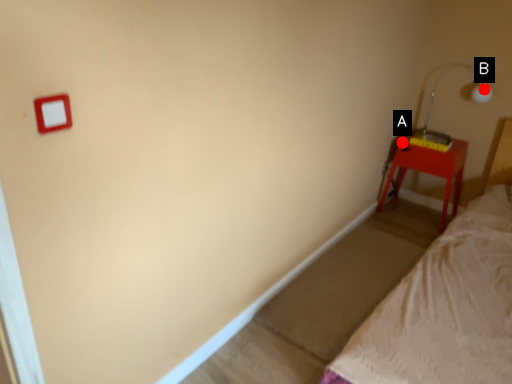
Question: Two points are circled on the image, labeled by A and B beside each circle. Which point is closer to the camera?

Choices:
 (A) A is closer
 (B) B is closer

Answer: (B)